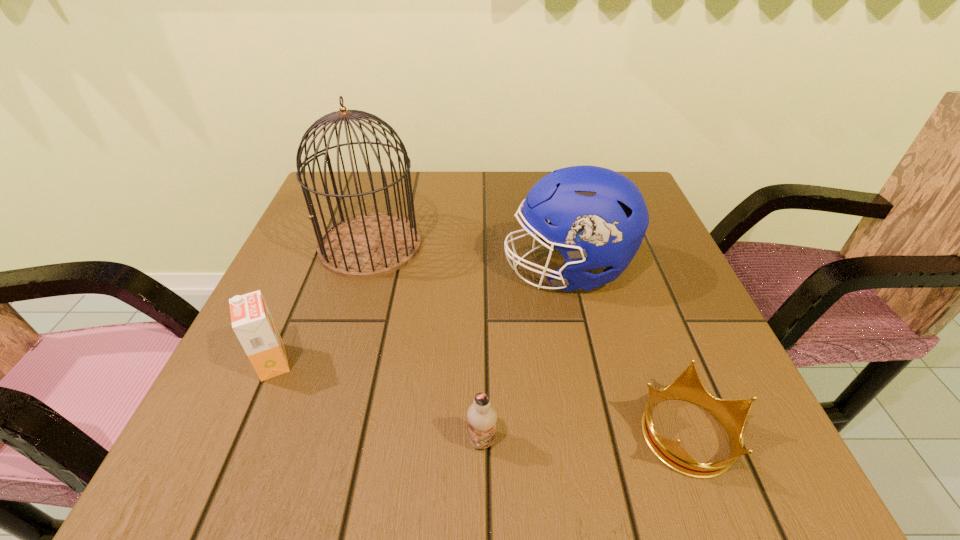
Image resolution: width=960 pixels, height=540 pixels. I want to click on blank area located 0.290m on the front-facing side of the fourth shortest object, so click(x=366, y=270).

Locate an element on the screen. Image resolution: width=960 pixels, height=540 pixels. vacant area situated 0.110m on the right of the third farthest object is located at coordinates (358, 362).

You are a GUI agent. You are given a task and a screenshot of the screen. Output one action in this format:
    pyautogui.click(x=<x>, y=<y>)
    Task: Click on the vacant space located on the back of the third object from left to right
    This screenshot has width=960, height=540.
    Given the screenshot: What is the action you would take?
    pyautogui.click(x=482, y=349)

Locate an element on the screen. vacant space located on the back of the shortest object is located at coordinates (634, 288).

Identify the location of object that is at the far edge. The width and height of the screenshot is (960, 540). pos(369,245).

Find the location of a particular element. The image size is (960, 540). chocolate milk present at the near edge is located at coordinates (482, 417).

Locate an element on the screen. The height and width of the screenshot is (540, 960). crown that is at the near edge is located at coordinates (732, 414).

The height and width of the screenshot is (540, 960). Identify the location of birdcage located at the left edge. (369, 245).

The width and height of the screenshot is (960, 540). Find the location of `orange juice located at the left edge`. orange juice located at the left edge is located at coordinates (252, 322).

At what (x,y) coordinates should I click in order to perform the action: click on football helmet that is at the right edge. Please return your answer as a coordinate pair (x, y). The image size is (960, 540). Looking at the image, I should click on (597, 218).